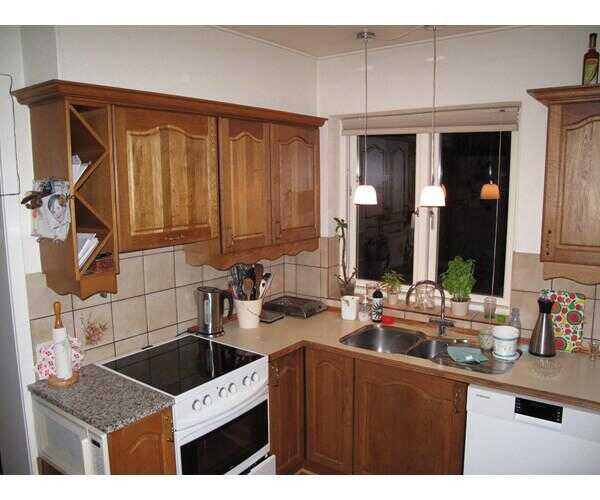
I want to click on black glass cooktop, so click(201, 372).